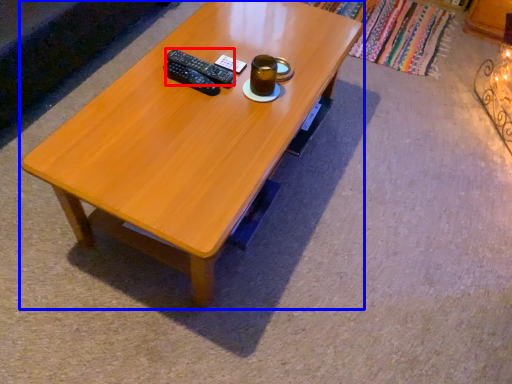
Question: Which object is closer to the camera taking this photo, remote (highlighted by a red box) or coffee table (highlighted by a blue box)?

Choices:
 (A) remote
 (B) coffee table

Answer: (B)